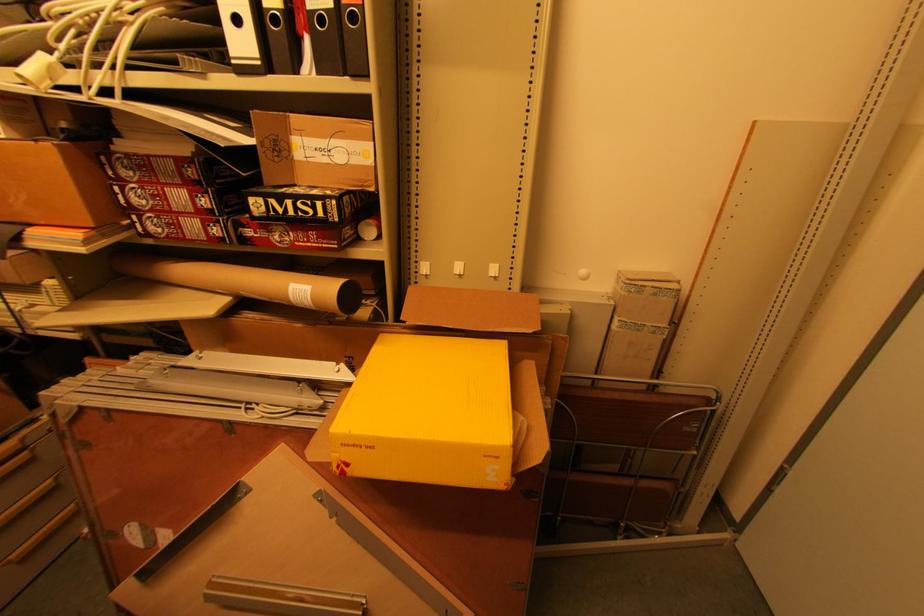
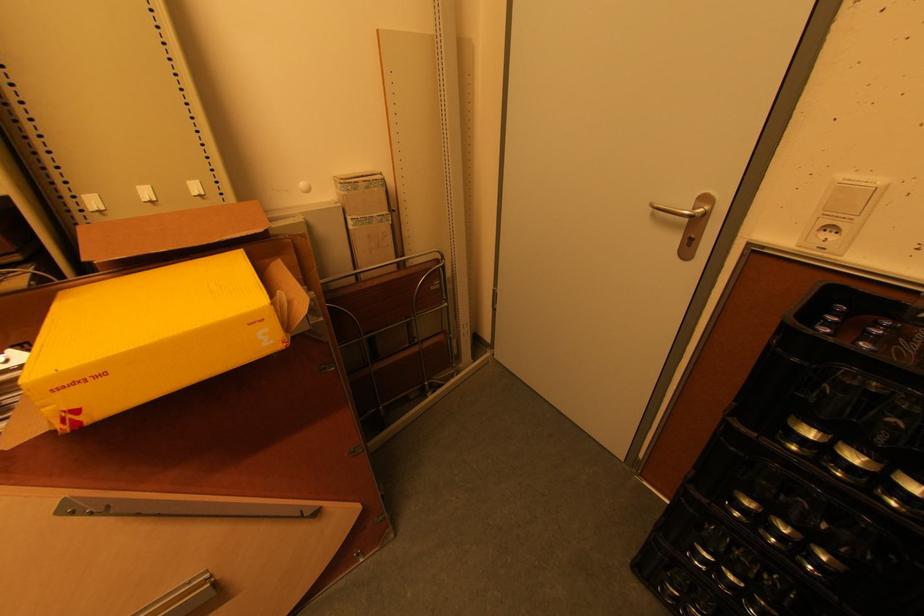
Question: The first image is from the beginning of the video and the second image is from the end. How did the camera likely rotate when shooting the video?

Choices:
 (A) Left
 (B) Right
 (C) Up
 (D) Down

Answer: (B)